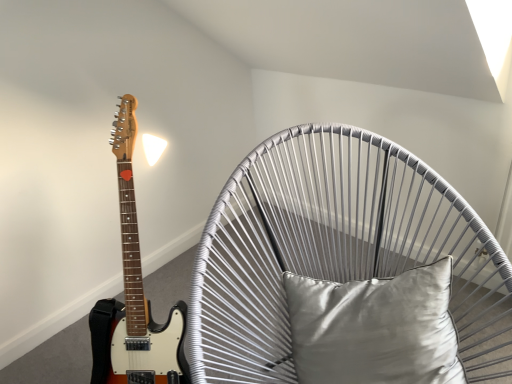
Question: Visually, is satin gray pillow at center positioned to the left or to the right of metallic wire swivel chair at center?

Choices:
 (A) right
 (B) left

Answer: (A)

Question: In terms of height, does satin gray pillow at center look taller or shorter compared to metallic wire swivel chair at center?

Choices:
 (A) short
 (B) tall

Answer: (A)

Question: Would you say satin gray pillow at center is inside or outside metallic wire swivel chair at center?

Choices:
 (A) outside
 (B) inside

Answer: (B)

Question: From the image's perspective, is metallic wire swivel chair at center located above or below satin gray pillow at center?

Choices:
 (A) below
 (B) above

Answer: (A)

Question: In terms of width, does metallic wire swivel chair at center look wider or thinner when compared to satin gray pillow at center?

Choices:
 (A) thin
 (B) wide

Answer: (B)

Question: Do you think metallic wire swivel chair at center is within satin gray pillow at center, or outside of it?

Choices:
 (A) inside
 (B) outside

Answer: (B)

Question: Is metallic wire swivel chair at center to the left or to the right of satin gray pillow at center in the image?

Choices:
 (A) left
 (B) right

Answer: (A)